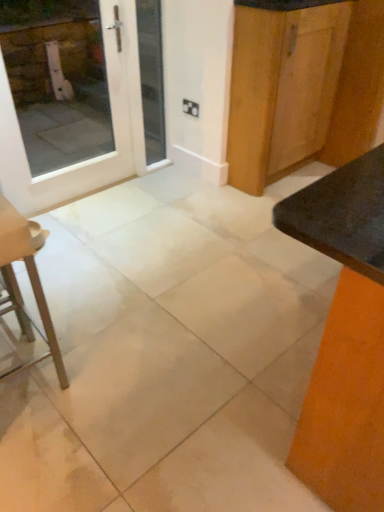
Question: From a real-world perspective, is white tile floor at center above or below white glass door at upper left?

Choices:
 (A) below
 (B) above

Answer: (A)

Question: Is white tile floor at center wider or thinner than white glass door at upper left?

Choices:
 (A) thin
 (B) wide

Answer: (B)

Question: Which of these objects is positioned farthest from the metallic silver stool at lower left?

Choices:
 (A) wooden cabinet at upper right
 (B) white glossy door at upper left
 (C) matte black table at right
 (D) white glass door at upper left
 (E) white tile floor at center

Answer: (D)

Question: Which is nearer to the white tile floor at center?

Choices:
 (A) white glossy door at upper left
 (B) matte black table at right
 (C) metallic silver stool at lower left
 (D) white glass door at upper left
 (E) wooden cabinet at upper right

Answer: (C)